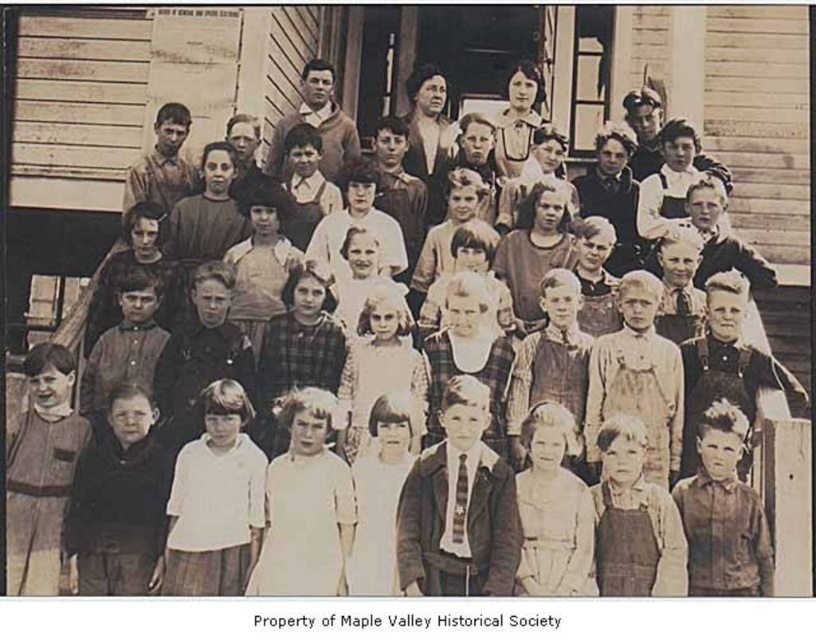
Question: Estimate the real-world distances between objects in this image. Which object is farther from the matte white blouse at center?

Choices:
 (A) smooth brown shirt at center
 (B) matte brown dress at center

Answer: (A)

Question: Which object appears closest to the camera in this image?

Choices:
 (A) matte brown dress at center
 (B) smooth brown shirt at center
 (C) matte white blouse at center

Answer: (B)

Question: In this image, where is smooth brown shirt at center located relative to matte white blouse at center?

Choices:
 (A) left
 (B) right

Answer: (A)

Question: Is matte brown dress at center smaller than matte white blouse at center?

Choices:
 (A) no
 (B) yes

Answer: (A)

Question: Can you confirm if matte brown dress at center is positioned above matte white blouse at center?

Choices:
 (A) no
 (B) yes

Answer: (B)

Question: Which is nearer to the smooth brown shirt at center?

Choices:
 (A) matte brown dress at center
 (B) matte white blouse at center

Answer: (A)